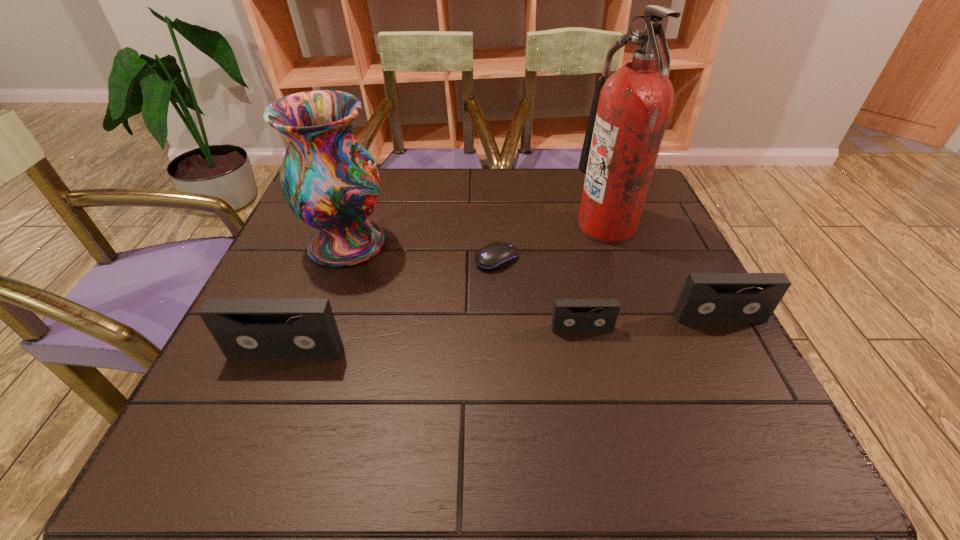
What are the coordinates of `empty space that is in between the second farthest videotape and the nearest videotape` in the screenshot? It's located at (434, 340).

The image size is (960, 540). In order to click on empty space that is in between the second tallest object and the fifth tallest object in this screenshot , I will do `click(465, 286)`.

Identify the location of empty space between the tallest object and the fourth farthest object. (662, 272).

You are a GUI agent. You are given a task and a screenshot of the screen. Output one action in this format:
    pyautogui.click(x=<x>, y=<y>)
    Task: Click on the vacant space in between the fire extinguisher and the rightmost videotape
    The width and height of the screenshot is (960, 540).
    Given the screenshot: What is the action you would take?
    pyautogui.click(x=662, y=272)

Where is `vacant space that is in between the computer mouse and the leftmost videotape`? vacant space that is in between the computer mouse and the leftmost videotape is located at coordinates (392, 306).

I want to click on free space between the shortest object and the nearest videotape, so coord(392,306).

Where is `unoccupied area between the tallest object and the computer mouse`? unoccupied area between the tallest object and the computer mouse is located at coordinates (551, 243).

You are a GUI agent. You are given a task and a screenshot of the screen. Output one action in this format:
    pyautogui.click(x=<x>, y=<y>)
    Task: Click on the blank region between the computer mouse and the second tallest object
    The image size is (960, 540).
    Given the screenshot: What is the action you would take?
    pyautogui.click(x=422, y=252)

Identify which object is the third nearest to the tallest object. Please provide its 2D coordinates. Your answer should be formatted as a tuple, i.e. [(x, y)], where the tuple contains the x and y coordinates of a point satisfying the conditions above.

[(569, 315)]

Locate which object ranks second in proximity to the shortest videotape. Please provide its 2D coordinates. Your answer should be formatted as a tuple, i.e. [(x, y)], where the tuple contains the x and y coordinates of a point satisfying the conditions above.

[(497, 255)]